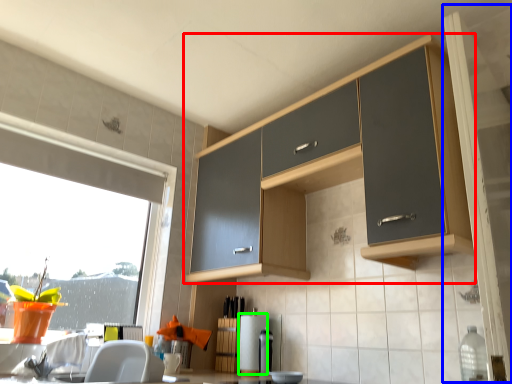
Question: Based on their relative distances, which object is nearer to cabinetry (highlighted by a red box)? Choose from screen door (highlighted by a blue box) and appliance (highlighted by a green box).

Choices:
 (A) screen door
 (B) appliance

Answer: (A)